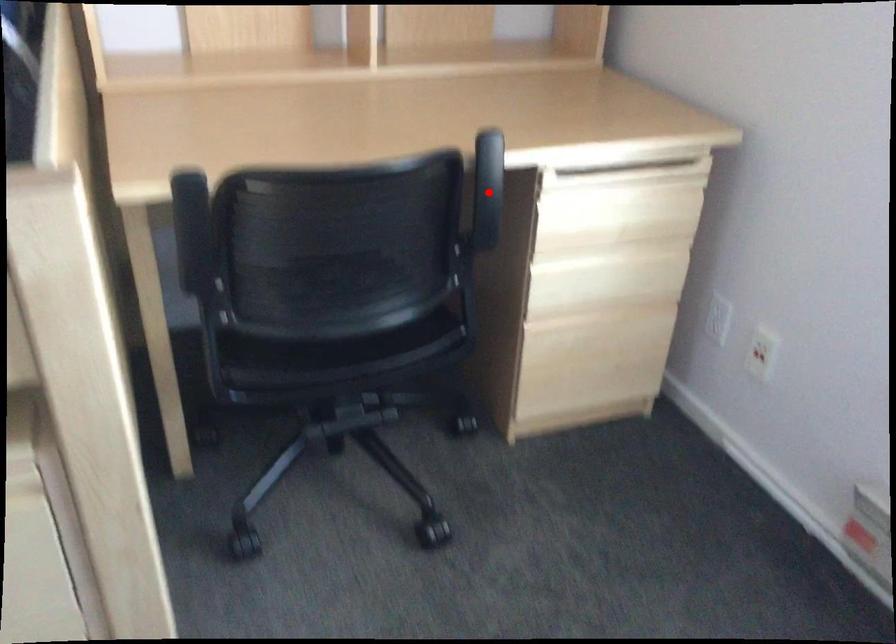
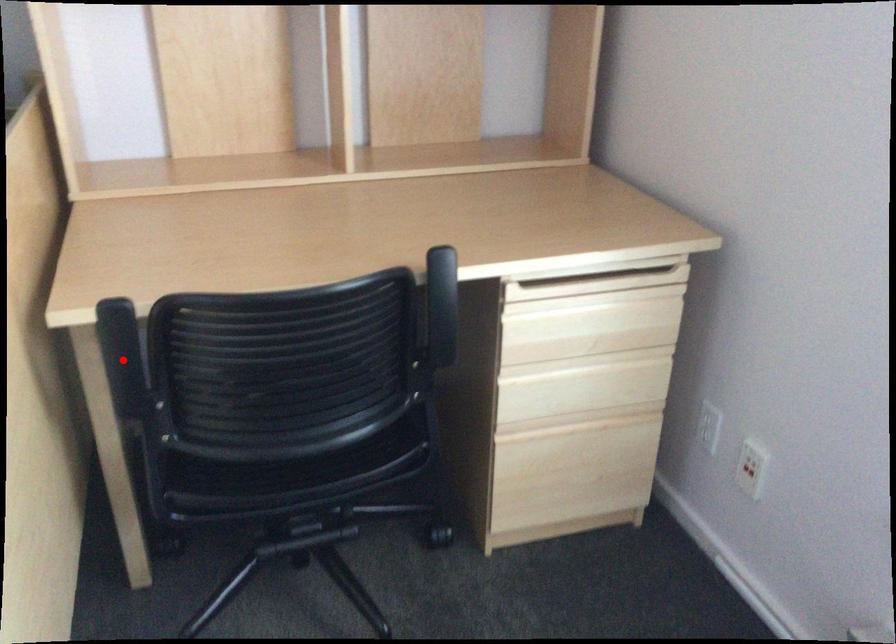
I am providing you with two images of the same scene from different viewpoints. A red point is marked on the first image and another point is marked on the second image. Does the point marked in image1 correspond to the same location as the one in image2?

No